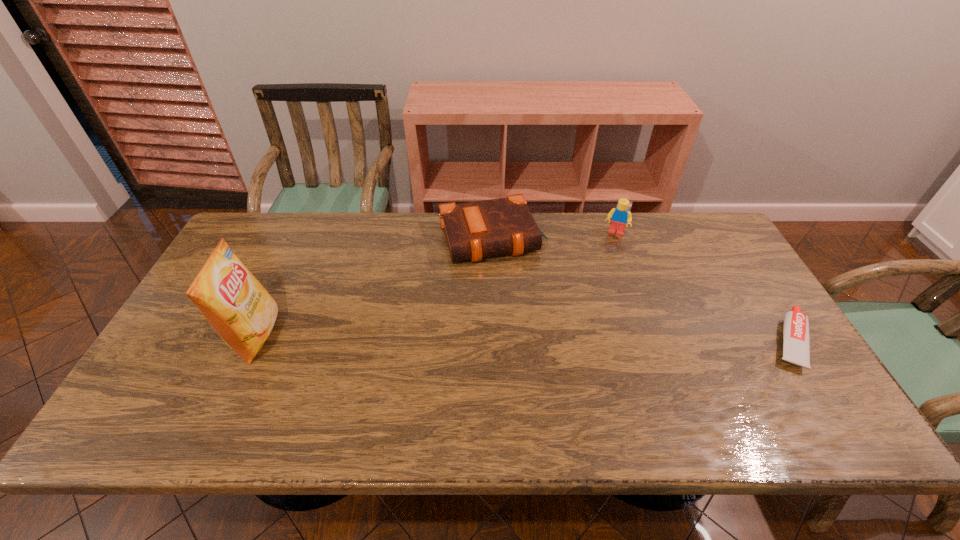
At what (x,y) coordinates should I click in order to perform the action: click on object present at the right edge. Please return your answer as a coordinate pair (x, y). The height and width of the screenshot is (540, 960). Looking at the image, I should click on (796, 342).

Identify the location of object located at the near right corner. (796, 342).

In the image, there is a desktop. Identify the location of free space at the far edge. (566, 251).

Locate an element on the screen. The width and height of the screenshot is (960, 540). vacant space at the near edge is located at coordinates [x=616, y=378].

This screenshot has width=960, height=540. In order to click on vacant space at the right edge in this screenshot , I will do `click(747, 282)`.

Where is `vacant space at the far right corner of the desktop`? This screenshot has width=960, height=540. vacant space at the far right corner of the desktop is located at coordinates (711, 239).

This screenshot has height=540, width=960. In order to click on free location at the near right corner in this screenshot , I will do `click(818, 389)`.

Locate an element on the screen. Image resolution: width=960 pixels, height=540 pixels. empty location between the toothpaste and the crisp (potato chip) is located at coordinates (522, 339).

The height and width of the screenshot is (540, 960). Identify the location of free space between the Lego and the second shortest object. (553, 235).

Find the location of a particular element. The height and width of the screenshot is (540, 960). vacant space that is in between the crisp (potato chip) and the rightmost object is located at coordinates (522, 339).